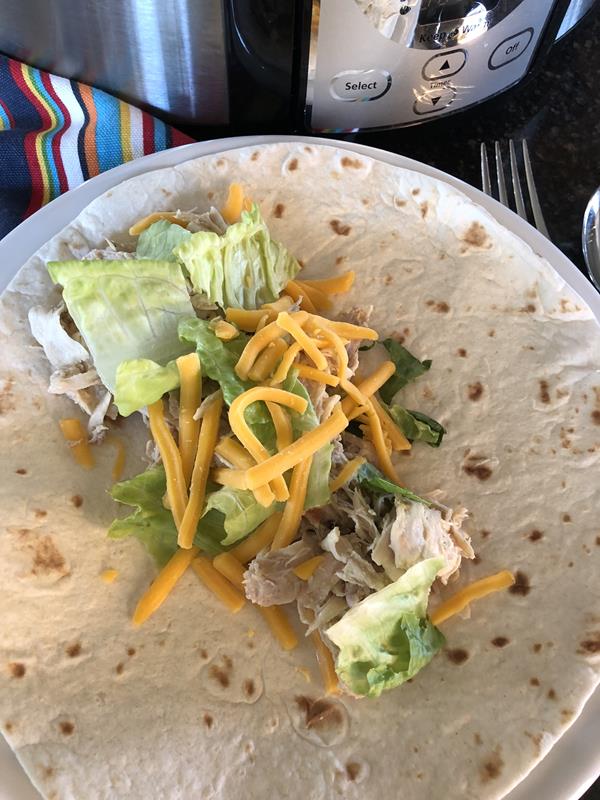
Identify the location of instant pot. The image size is (600, 800). (175, 53).